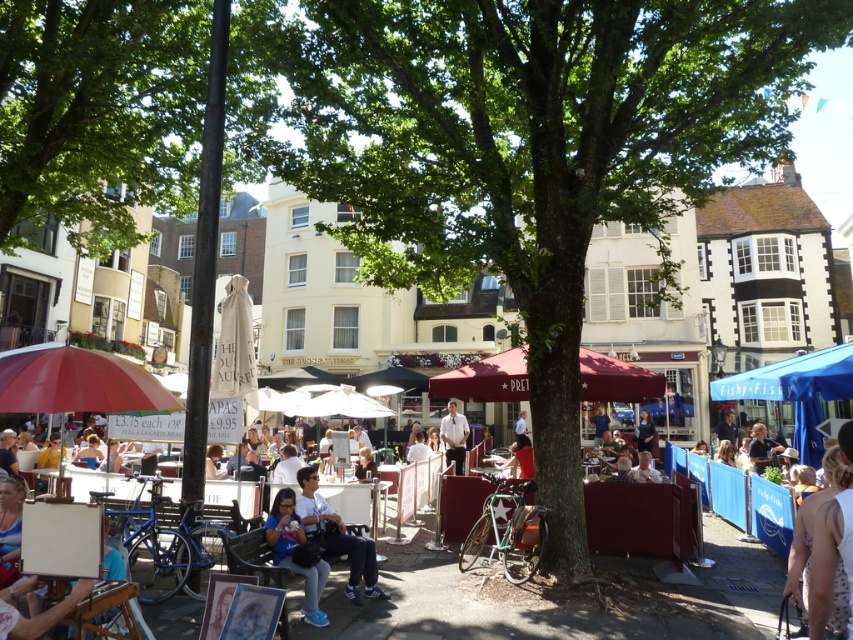
You are standing at the point marked as point (78, 381) in the image. What object are you standing on?

The point (78, 381) is on the matte red umbrella at lower left, so you are standing on the matte red umbrella at lower left.

You are a photographer trying to capture a clear shot of the dark brown hair at center without any obstructions. Given the presence of the green leafy tree at center, which is much taller, would the tree block your view of the hair?

The green leafy tree at center is much taller than the dark brown hair at center, so the tree would block the view of the dark brown hair at center.